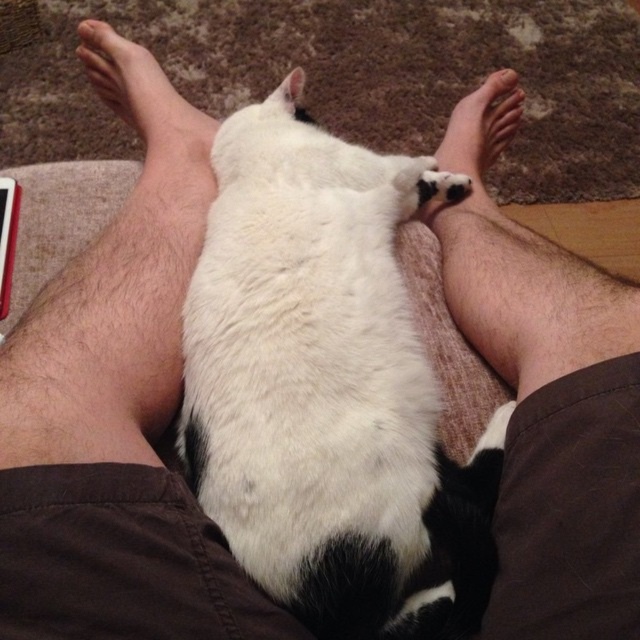
Can you confirm if white soft skin at center is positioned below skinny barefoot at upper left?

Yes, white soft skin at center is below skinny barefoot at upper left.

Based on the photo, how far apart are white soft skin at center and skinny barefoot at upper left?

white soft skin at center and skinny barefoot at upper left are 15.95 inches apart.

At what (x,y) coordinates should I click in order to perform the action: click on white soft skin at center. Please return your answer as a coordinate pair (x, y). Looking at the image, I should click on (476, 150).

Find the location of a particular element. The height and width of the screenshot is (640, 640). white soft skin at center is located at coordinates (476, 150).

Is white soft fur cat at center taller than skinny barefoot at upper left?

Correct, white soft fur cat at center is much taller as skinny barefoot at upper left.

Where is `white soft fur cat at center`? Image resolution: width=640 pixels, height=640 pixels. white soft fur cat at center is located at coordinates (326, 387).

Identify the location of white soft fur cat at center. (326, 387).

Which is in front, point (483, 481) or point (513, 92)?

Point (483, 481) is in front.

Does white soft fur cat at center appear over white soft skin at center?

Incorrect, white soft fur cat at center is not positioned above white soft skin at center.

Does point (257, 477) come closer to viewer compared to point (499, 212)?

Yes, point (257, 477) is in front of point (499, 212).

Find the location of `white soft fur cat at center`. white soft fur cat at center is located at coordinates (326, 387).